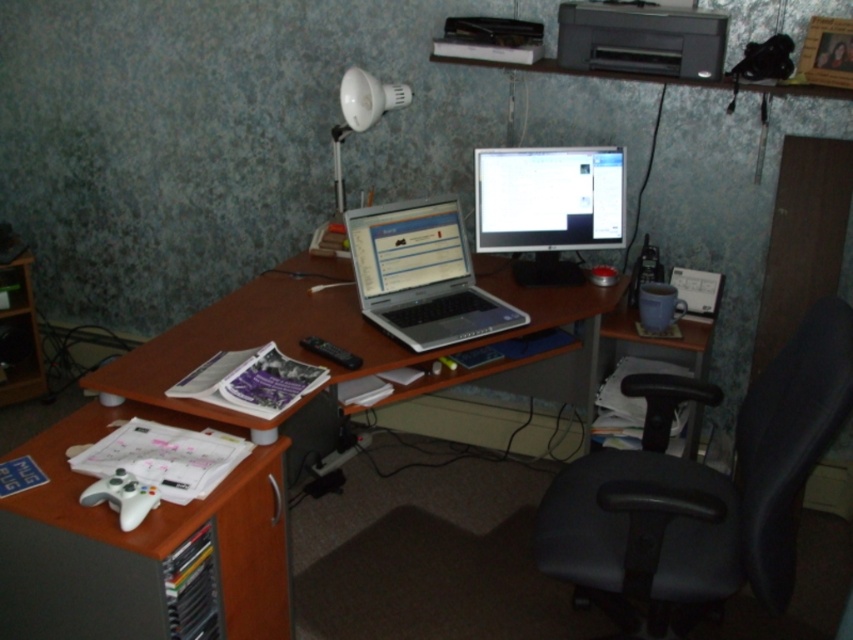
You are setting up a new webcam for a streaming setup and need to position it so that both the white plastic game controller at lower left and the matte black monitor at center are visible in the frame. Based on their positions, which object should be closer to the front of the desk to ensure both are in view?

The white plastic game controller at lower left is in front of the matte black monitor at center, so positioning the webcam to face the front of the desk will naturally include both objects in the frame since the game controller is closer to the edge and the monitor is slightly behind it.

You are organizing your home office and want to place a new decorative item between the white plastic game controller at lower left and the brown wood desk at center. Based on their positions, which side of the desk should you place it on?

The white plastic game controller at lower left is to the left of the brown wood desk at center, so placing the decorative item between them would require positioning it to the left side of the desk.

You are setting up a new camera in your home office. You want to place it so that it can capture both the white plastic game controller at lower left and the monitor on the right side of the desk. Given that the camera has a 6 feet range, will it be able to capture both objects?

The white plastic game controller at lower left and camera are 5.01 feet apart from each other. Since the camera has a 6 feet range, it can capture both objects as the distance between them is within the range.